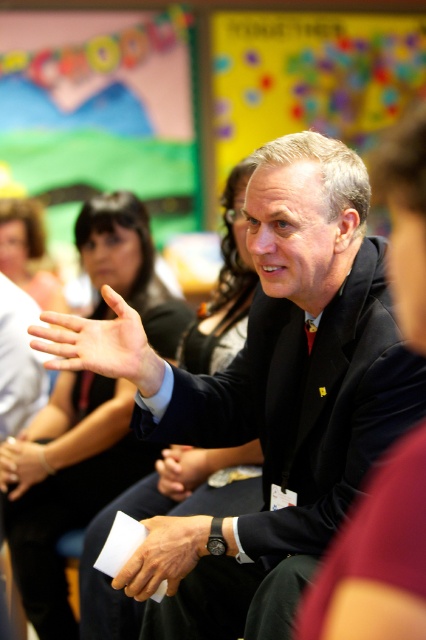
Question: Is black matte suit at center below matte black hand at center?

Choices:
 (A) yes
 (B) no

Answer: (B)

Question: Considering the real-world distances, which object is closest to the smooth skin hand at center?

Choices:
 (A) white paper at center
 (B) smooth skin hands at center
 (C) black matte suit at center

Answer: (C)

Question: Which object appears farthest from the camera in this image?

Choices:
 (A) matte black hand at center
 (B) black matte suit at center

Answer: (A)

Question: Can you confirm if black matte suit at center is wider than smooth skin hands at center?

Choices:
 (A) yes
 (B) no

Answer: (A)

Question: Which point appears farthest from the camera in this image?

Choices:
 (A) (120, 580)
 (B) (201, 481)

Answer: (B)

Question: Does black matte suit at center appear over smooth skin hands at center?

Choices:
 (A) no
 (B) yes

Answer: (B)